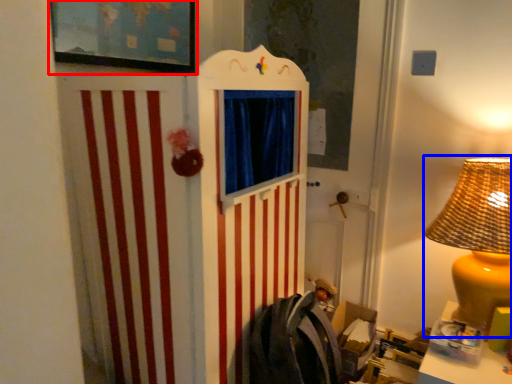
Question: Which point is closer to the camera, picture frame (highlighted by a red box) or table lamp (highlighted by a blue box)?

Choices:
 (A) picture frame
 (B) table lamp

Answer: (B)